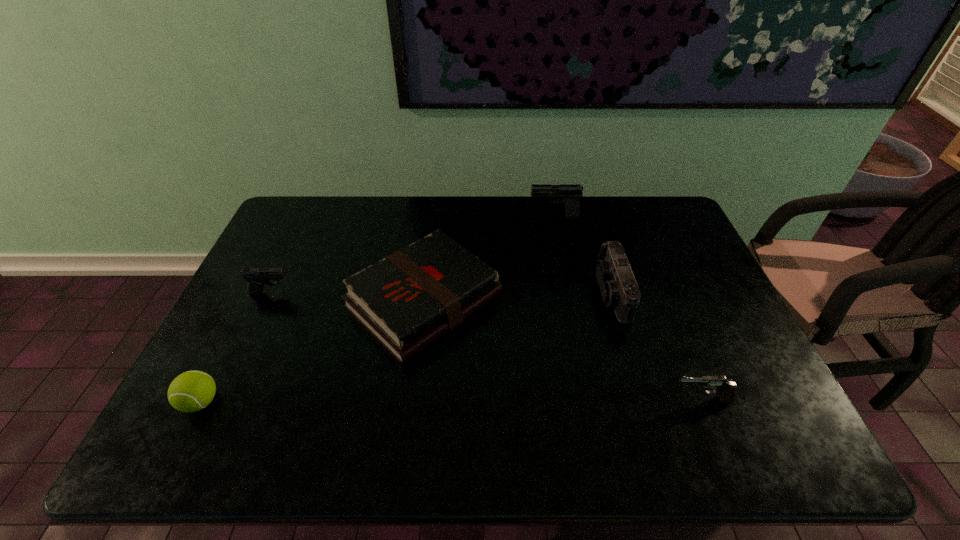
Point out which pistol is positioned as the second nearest to the farthest pistol. Please provide its 2D coordinates. Your answer should be formatted as a tuple, i.e. [(x, y)], where the tuple contains the x and y coordinates of a point satisfying the conditions above.

[(257, 277)]

Where is `vacant area that satisfies the following two spatial constraints: 1. aim along the barrel of the farthest object; 2. on the front side of the third object from left to right`? The height and width of the screenshot is (540, 960). vacant area that satisfies the following two spatial constraints: 1. aim along the barrel of the farthest object; 2. on the front side of the third object from left to right is located at coordinates (571, 301).

This screenshot has height=540, width=960. In order to click on vacant area in the image that satisfies the following two spatial constraints: 1. at the barrel of the rightmost pistol; 2. on the front side of the tennis ball in this screenshot , I will do `click(703, 402)`.

Find the location of a particular element. The height and width of the screenshot is (540, 960). vacant space that satisfies the following two spatial constraints: 1. on the back side of the fourth object from right to left; 2. on the left side of the tennis ball is located at coordinates (252, 301).